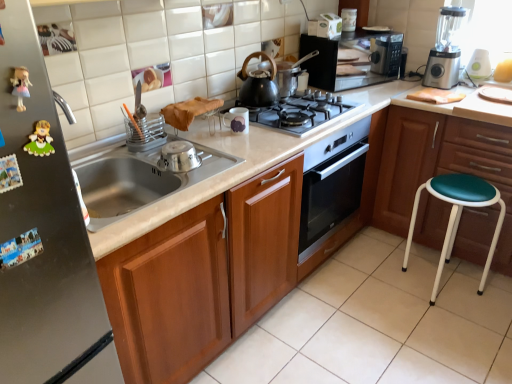
Question: Could you tell me if satin silver fridge at left is turned towards plastic figurine at left?

Choices:
 (A) no
 (B) yes

Answer: (B)

Question: Is satin silver fridge at left far from plastic figurine at left?

Choices:
 (A) yes
 (B) no

Answer: (B)

Question: Is satin silver fridge at left wider than plastic figurine at left?

Choices:
 (A) no
 (B) yes

Answer: (B)

Question: From the image's perspective, is satin silver fridge at left on top of plastic figurine at left?

Choices:
 (A) no
 (B) yes

Answer: (A)

Question: From a real-world perspective, is satin silver fridge at left over plastic figurine at left?

Choices:
 (A) yes
 (B) no

Answer: (B)

Question: From the image's perspective, does satin silver fridge at left appear lower than plastic figurine at left?

Choices:
 (A) yes
 (B) no

Answer: (A)

Question: Is teal vinyl stool at lower right wider than stainless steel bowl at sink, the first appliance viewed from the front?

Choices:
 (A) yes
 (B) no

Answer: (A)

Question: Is stainless steel bowl at sink, the 3th appliance in the top-to-bottom sequence, inside teal vinyl stool at lower right?

Choices:
 (A) yes
 (B) no

Answer: (B)

Question: Is teal vinyl stool at lower right taller than stainless steel bowl at sink, which ranks as the 3th appliance in back-to-front order?

Choices:
 (A) yes
 (B) no

Answer: (A)

Question: Is teal vinyl stool at lower right in contact with stainless steel bowl at sink, the first appliance viewed from the front?

Choices:
 (A) yes
 (B) no

Answer: (B)

Question: Is teal vinyl stool at lower right shorter than stainless steel bowl at sink, the 1th appliance positioned from the bottom?

Choices:
 (A) no
 (B) yes

Answer: (A)

Question: Is teal vinyl stool at lower right at the left side of stainless steel bowl at sink, the 1th appliance positioned from the bottom?

Choices:
 (A) yes
 (B) no

Answer: (B)

Question: Is stainless steel bowl at sink, the first appliance viewed from the front, bigger than satin silver fridge at left?

Choices:
 (A) yes
 (B) no

Answer: (B)